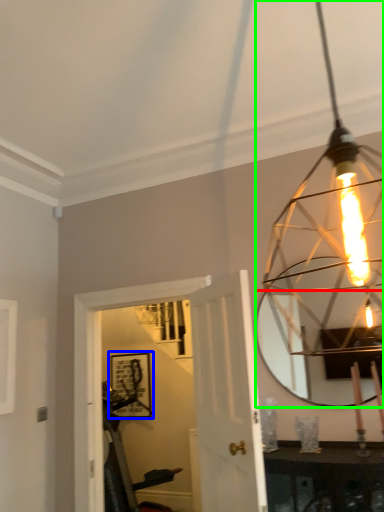
Question: Considering the real-world distances, which object is farthest from mirror (highlighted by a red box)? picture frame (highlighted by a blue box) or lamp (highlighted by a green box)?

Choices:
 (A) picture frame
 (B) lamp

Answer: (A)